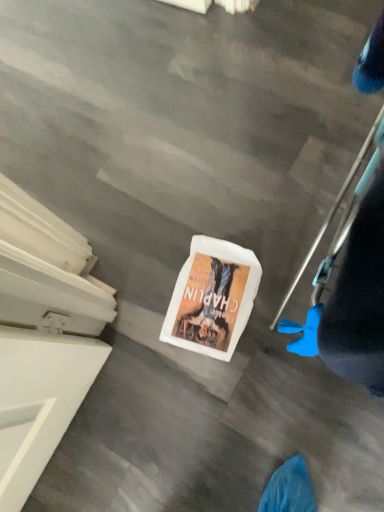
Identify the location of free space in front of white matte book at center. (256, 372).